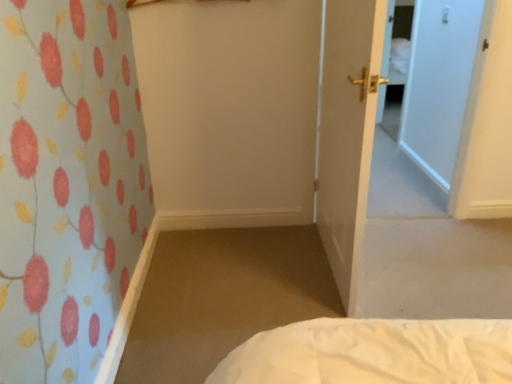
Question: Should I look upward or downward to see gold metallic door handle at center?

Choices:
 (A) up
 (B) down

Answer: (A)